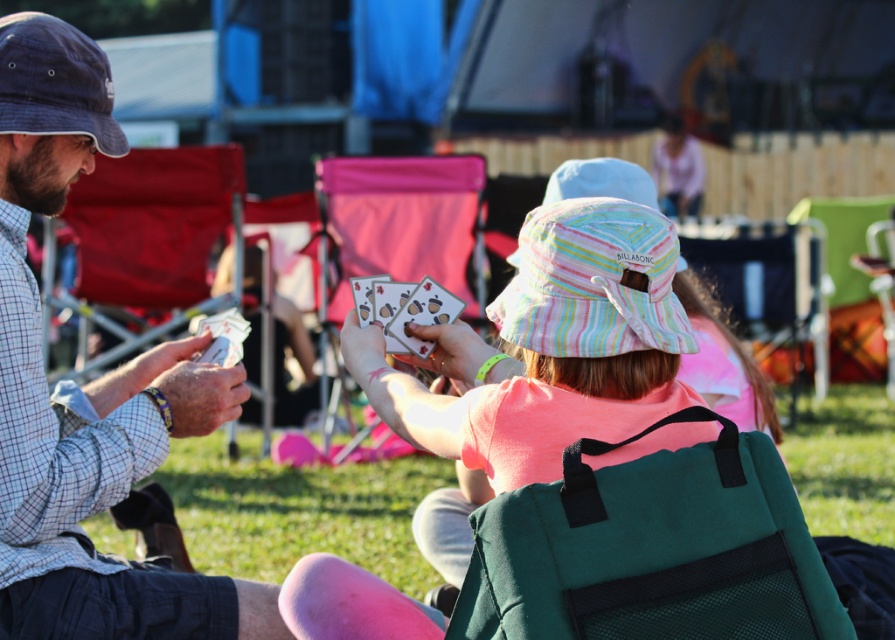
Question: Which point is closer to the camera?

Choices:
 (A) pink fabric chair at center
 (B) checkered fabric shirt at left
 (C) acorn-patterned paper cards at center
 (D) pink fabric shirt at center

Answer: (D)

Question: Which of these objects is positioned closest to the denim baseball hat at left?

Choices:
 (A) acorn-patterned paper cards at center
 (B) pink fabric chair at center

Answer: (A)

Question: Does pink fabric shirt at center have a greater width compared to acorn-patterned paper cards at center?

Choices:
 (A) no
 (B) yes

Answer: (B)

Question: Among these points, which one is farthest from the camera?

Choices:
 (A) (108, 154)
 (B) (150, 600)
 (C) (327, 168)

Answer: (C)

Question: Can you confirm if checkered fabric shirt at left is positioned to the left of pastel striped fabric baseball hat at center?

Choices:
 (A) no
 (B) yes

Answer: (B)

Question: Considering the relative positions of pink fabric shirt at center and pastel striped fabric baseball hat at center in the image provided, where is pink fabric shirt at center located with respect to pastel striped fabric baseball hat at center?

Choices:
 (A) left
 (B) right

Answer: (A)